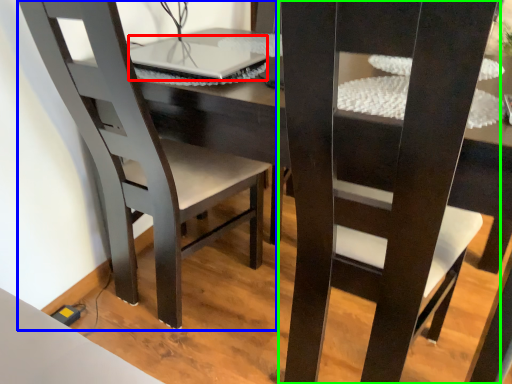
Question: Considering the real-world distances, which object is farthest from laptop (highlighted by a red box)? chair (highlighted by a blue box) or chair (highlighted by a green box)?

Choices:
 (A) chair
 (B) chair

Answer: (B)